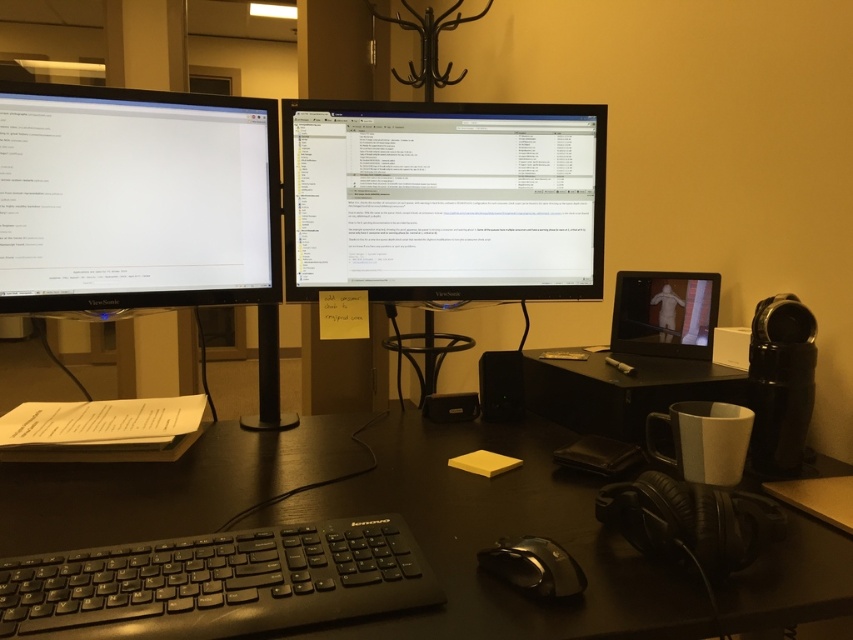
Who is higher up, black glossy monitor at center or matte black monitor at left?

matte black monitor at left

Does black glossy monitor at center have a greater width compared to matte black monitor at left?

Correct, the width of black glossy monitor at center exceeds that of matte black monitor at left.

Between point (393, 164) and point (247, 256), which one is positioned behind?

The point (393, 164) is behind.

This screenshot has width=853, height=640. Find the location of `black glossy monitor at center`. black glossy monitor at center is located at coordinates (444, 202).

Is black matte keyboard at center positioned before matte black tablet at center?

Yes, it is.

Who is lower down, black matte keyboard at center or matte black tablet at center?

black matte keyboard at center is below.

At what (x,y) coordinates should I click in order to perform the action: click on black matte keyboard at center. Please return your answer as a coordinate pair (x, y). Looking at the image, I should click on (218, 582).

This screenshot has height=640, width=853. Find the location of `black matte keyboard at center`. black matte keyboard at center is located at coordinates (218, 582).

How distant is black matte keyboard at lower left from matte black monitor at left?

The distance of black matte keyboard at lower left from matte black monitor at left is 16.43 inches.

Is black matte keyboard at lower left positioned at the back of matte black monitor at left?

No, it is in front of matte black monitor at left.

Is point (380, 456) behind point (120, 193)?

That is False.

Identify the location of black matte keyboard at lower left. This screenshot has height=640, width=853. (497, 538).